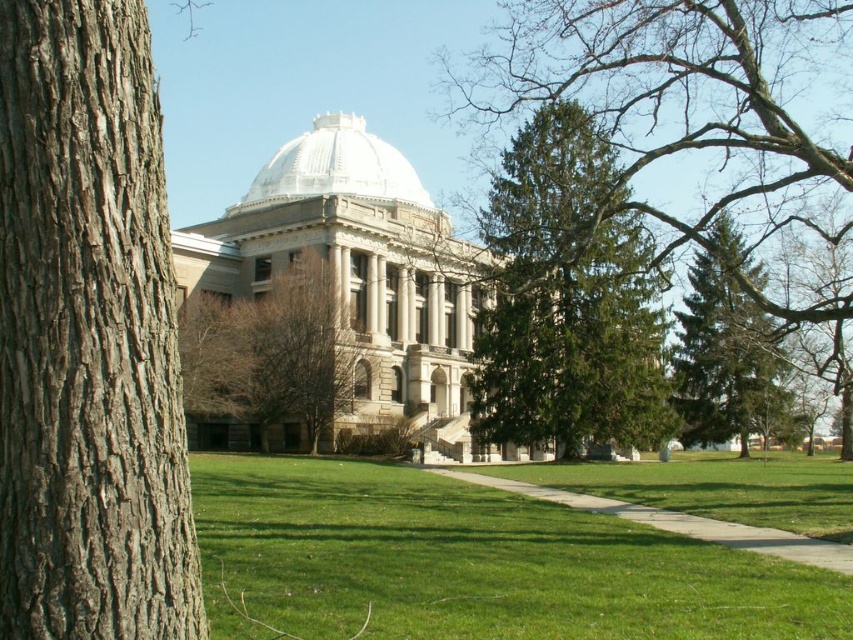
You are standing at the entrance of the classical building and want to walk to the point marked as point (x=252, y=408). However, you notice another point, point (x=592, y=163), along your path. Which point will you encounter first?

You will encounter point (x=592, y=163) first because it is closer to the viewer than point (x=252, y=408).

You are standing at the entrance of the classical building and want to walk to the green evergreen tree at center. However, there is a brown textured tree at center in the way. Can you walk between them without going around?

The green evergreen tree at center is 20.46 meters away from the brown textured tree at center, so yes, you can walk between them without going around since the distance is sufficient.